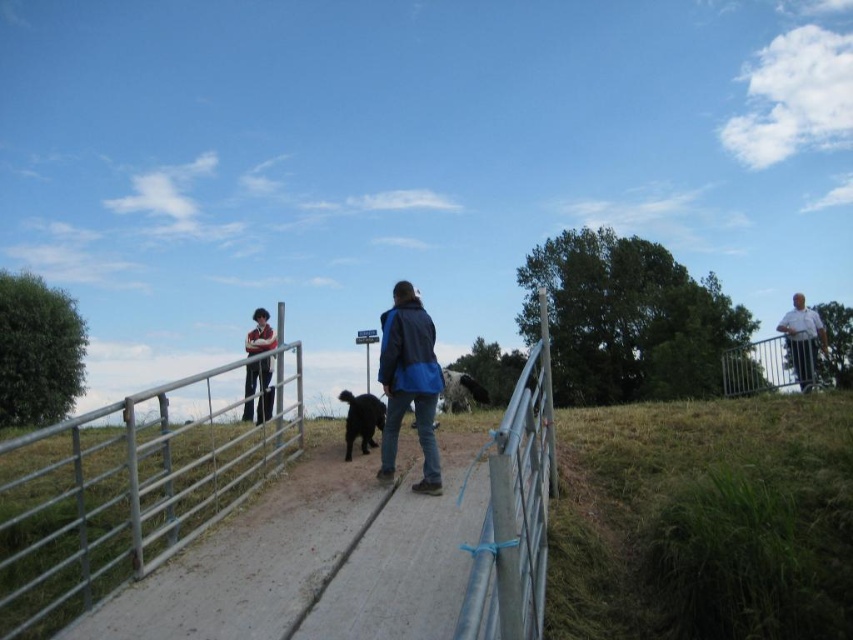
Does blue fabric jacket at center have a greater width compared to silver metallic fence at right?

No, blue fabric jacket at center is not wider than silver metallic fence at right.

Can you confirm if blue fabric jacket at center is shorter than silver metallic fence at right?

No, blue fabric jacket at center is not shorter than silver metallic fence at right.

Where is `blue fabric jacket at center`? This screenshot has width=853, height=640. blue fabric jacket at center is located at coordinates (409, 381).

Who is positioned more to the left, smooth concrete path at center or white cotton shirt at right?

Positioned to the left is smooth concrete path at center.

Is smooth concrete path at center shorter than white cotton shirt at right?

Indeed, smooth concrete path at center has a lesser height compared to white cotton shirt at right.

Who is more forward, (254, 544) or (817, 316)?

Positioned in front is point (254, 544).

The image size is (853, 640). Find the location of `smooth concrete path at center`. smooth concrete path at center is located at coordinates (312, 556).

Is point (390, 353) positioned after point (260, 340)?

No, it is not.

Between point (415, 388) and point (252, 337), which one is positioned behind?

The point (252, 337) is behind.

Where is `blue fabric jacket at center`? blue fabric jacket at center is located at coordinates [x=409, y=381].

The image size is (853, 640). Find the location of `blue fabric jacket at center`. blue fabric jacket at center is located at coordinates (409, 381).